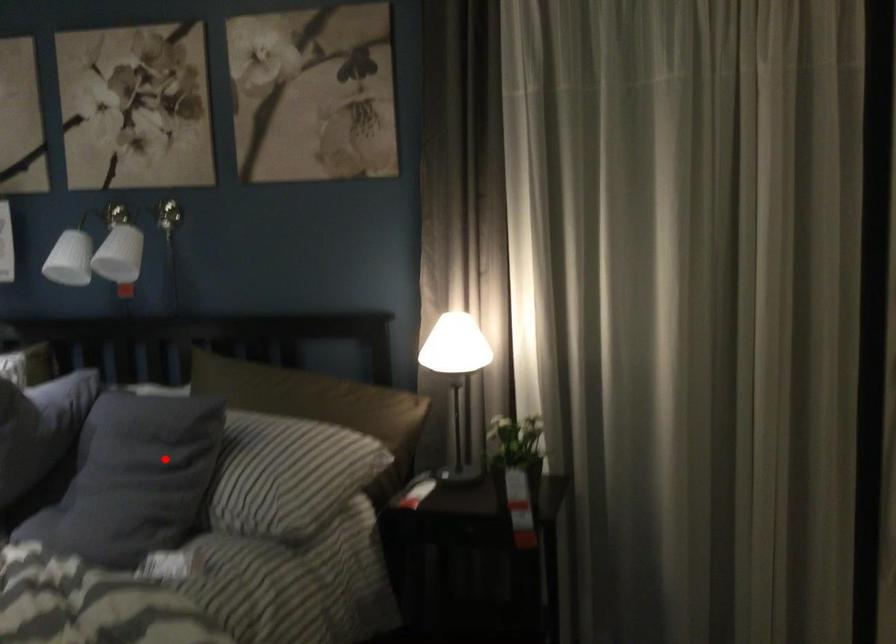
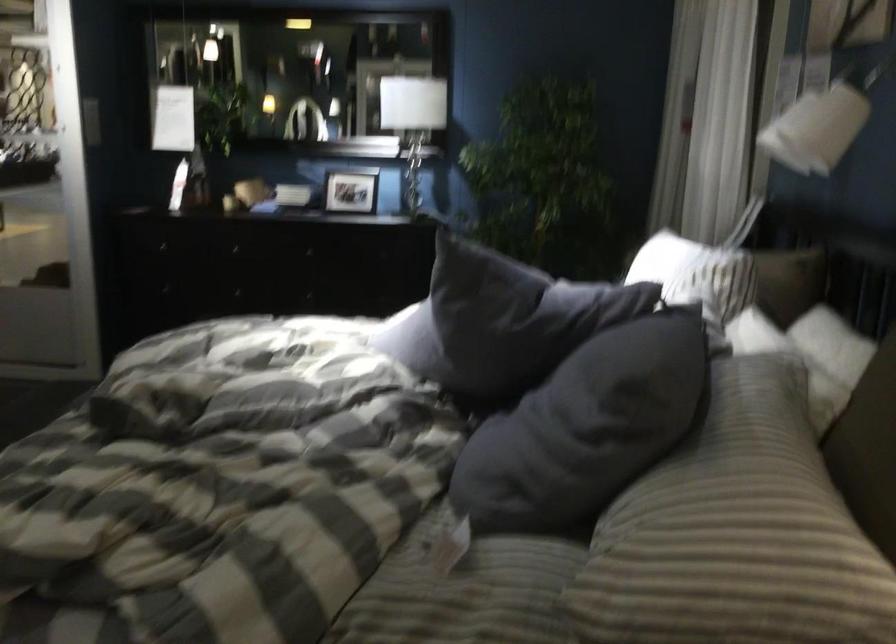
Question: A red point is marked in image1. In image2, is the corresponding 3D point closer to the camera or farther? Reply with the corresponding letter.

Choices:
 (A) The corresponding 3D point is closer.
 (B) The corresponding 3D point is farther.

Answer: (A)